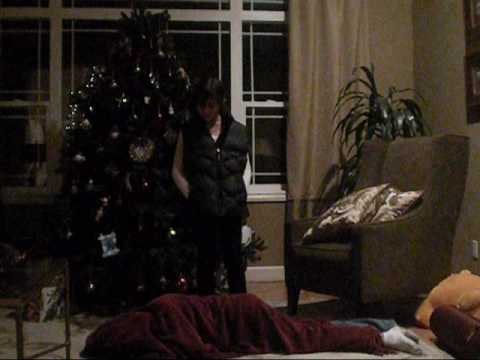
Locate an element on the screen. This screenshot has width=480, height=360. red blanket over body is located at coordinates (176, 323).